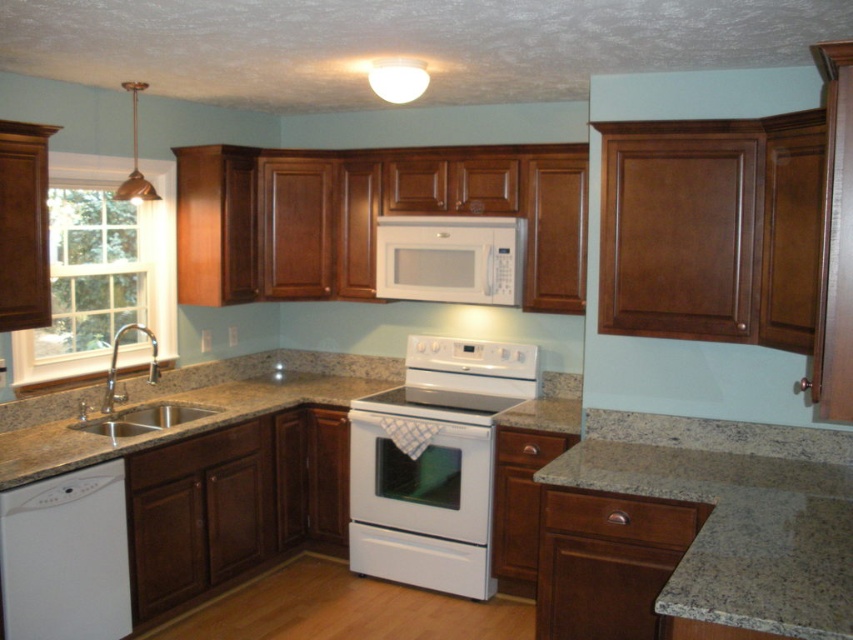
Question: Which of the following is the farthest from the observer?

Choices:
 (A) white glossy dishwasher at lower left
 (B) white glossy stove at center
 (C) white glossy electric stove at center

Answer: (B)

Question: Does white glossy dishwasher at lower left appear over white glossy stove at center?

Choices:
 (A) no
 (B) yes

Answer: (A)

Question: Can you confirm if white glossy electric stove at center is smaller than white glossy dishwasher at lower left?

Choices:
 (A) no
 (B) yes

Answer: (A)

Question: Based on their relative distances, which object is nearer to the white glossy electric stove at center?

Choices:
 (A) white matte microwave at upper center
 (B) white glossy dishwasher at lower left

Answer: (A)

Question: Is white glass window at left positioned before brown granite sink at lower left?

Choices:
 (A) yes
 (B) no

Answer: (A)

Question: Which of the following is the closest to the observer?

Choices:
 (A) white matte microwave at upper center
 (B) white glass window at left
 (C) white glossy stove at center

Answer: (B)